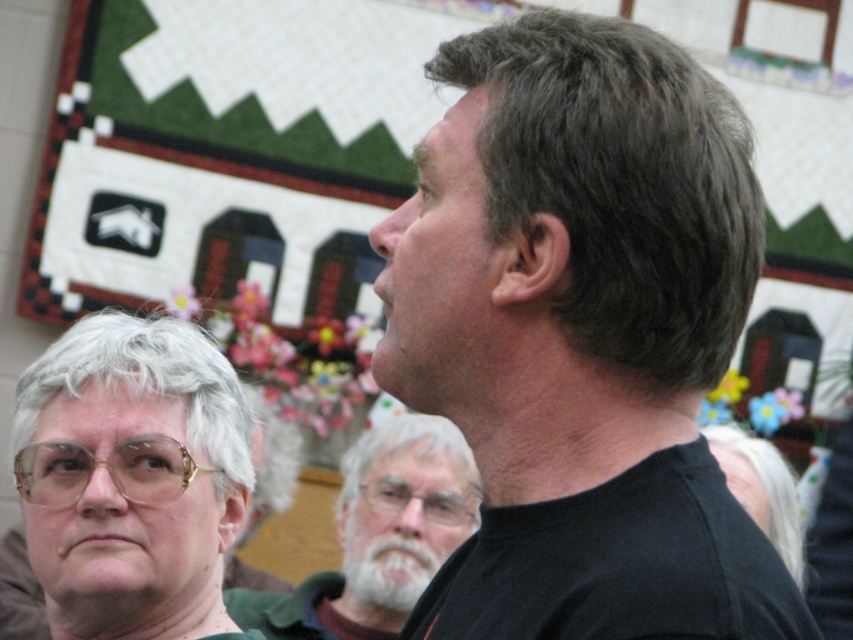
You are attending a community meeting and notice two people in the background. One has dark gray textured hair at upper right and another has a white beard at center. From your perspective, which one is positioned more to the right?

The dark gray textured hair at upper right is positioned more to the right than the white beard at center.